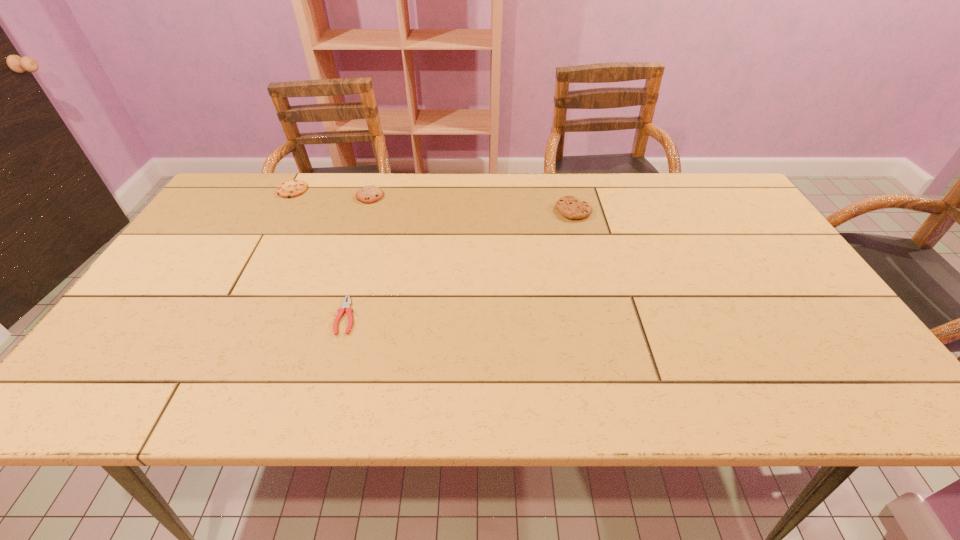
Image resolution: width=960 pixels, height=540 pixels. I want to click on the rightmost cookie, so (x=570, y=207).

Where is `the tallest cookie`? The width and height of the screenshot is (960, 540). the tallest cookie is located at coordinates (570, 207).

At what (x,y) coordinates should I click in order to perform the action: click on the second tallest cookie. Please return your answer as a coordinate pair (x, y). This screenshot has height=540, width=960. Looking at the image, I should click on (369, 194).

Identify the location of the third shortest object. (369, 194).

The image size is (960, 540). What are the coordinates of `the shortest cookie` in the screenshot? It's located at (293, 188).

In order to click on the leftmost object in this screenshot , I will do `click(293, 188)`.

The height and width of the screenshot is (540, 960). I want to click on pliers, so click(x=345, y=305).

You are a GUI agent. You are given a task and a screenshot of the screen. Output one action in this format:
    pyautogui.click(x=<x>, y=<y>)
    Task: Click on the nearest object
    The height and width of the screenshot is (540, 960).
    Given the screenshot: What is the action you would take?
    pyautogui.click(x=345, y=305)

Where is `vacant position located on the right of the rightmost cookie`? The image size is (960, 540). vacant position located on the right of the rightmost cookie is located at coordinates (637, 211).

This screenshot has height=540, width=960. What are the coordinates of `vacant area situated on the right of the second tallest cookie` in the screenshot? It's located at (504, 196).